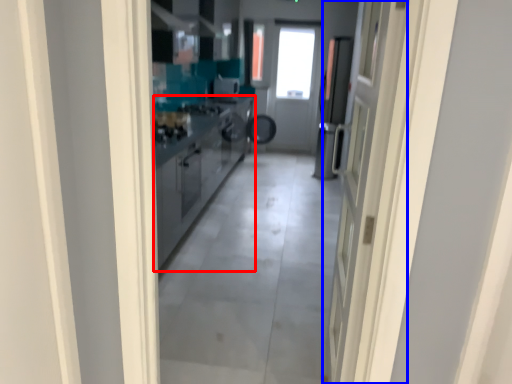
Question: Which object appears closest to the camera in this image, cabinetry (highlighted by a red box) or door (highlighted by a blue box)?

Choices:
 (A) cabinetry
 (B) door

Answer: (B)